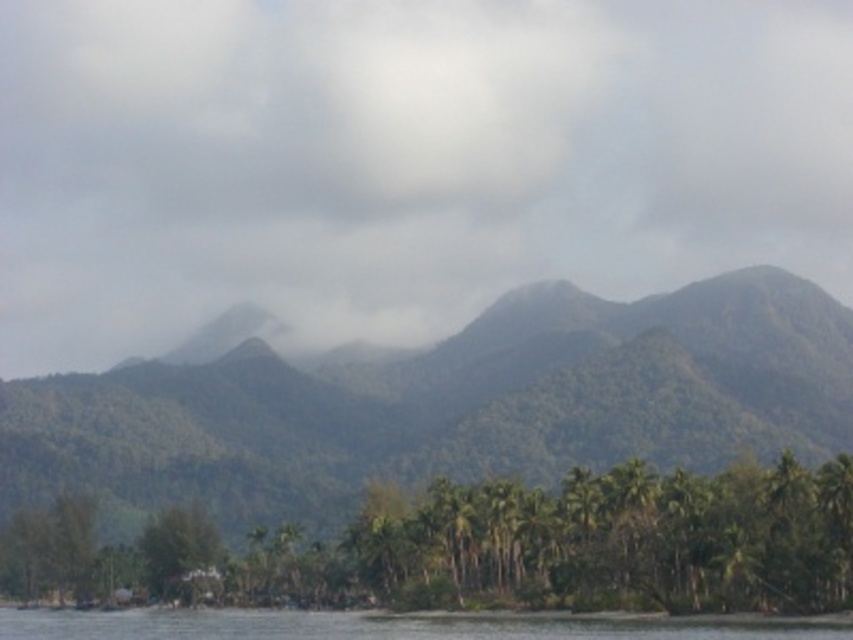
Who is lower down, white fluffy cloud at upper center or clear water at lower center?

clear water at lower center is lower down.

Which is more to the right, white fluffy cloud at upper center or clear water at lower center?

Positioned to the right is white fluffy cloud at upper center.

At what (x,y) coordinates should I click in order to perform the action: click on white fluffy cloud at upper center. Please return your answer as a coordinate pair (x, y). The image size is (853, 640). Looking at the image, I should click on (402, 161).

This screenshot has width=853, height=640. Find the location of `white fluffy cloud at upper center`. white fluffy cloud at upper center is located at coordinates (402, 161).

Between green leafy mountain at center and green leafy trees at lower center, which one has more height?

Standing taller between the two is green leafy mountain at center.

Does green leafy mountain at center appear on the right side of green leafy trees at lower center?

Indeed, green leafy mountain at center is positioned on the right side of green leafy trees at lower center.

What do you see at coordinates (447, 404) in the screenshot?
I see `green leafy mountain at center` at bounding box center [447, 404].

The width and height of the screenshot is (853, 640). I want to click on green leafy mountain at center, so (447, 404).

Is white fluffy cloud at upper center further to the viewer compared to green leafy mountain at center?

Yes, white fluffy cloud at upper center is behind green leafy mountain at center.

Which is above, white fluffy cloud at upper center or green leafy mountain at center?

white fluffy cloud at upper center is higher up.

Which is in front, point (136, 45) or point (297, 426)?

Point (297, 426) is in front.

The height and width of the screenshot is (640, 853). What are the coordinates of `white fluffy cloud at upper center` in the screenshot? It's located at (402, 161).